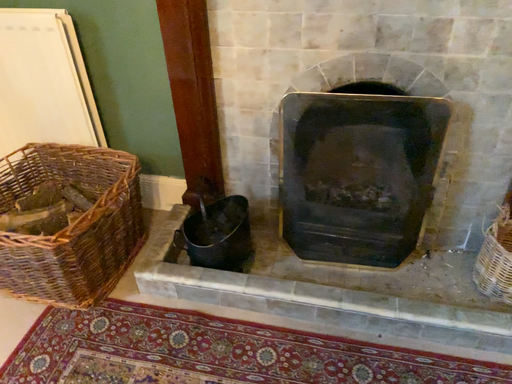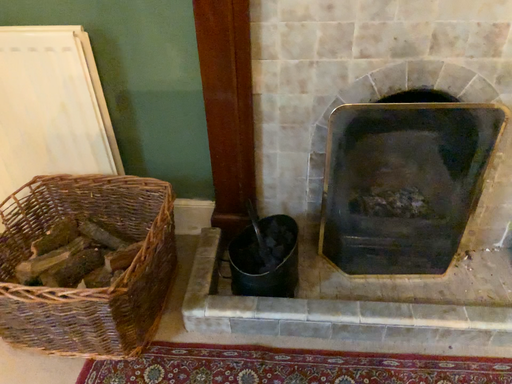
Question: Which way did the camera rotate in the video?

Choices:
 (A) rotated right
 (B) rotated left

Answer: (A)